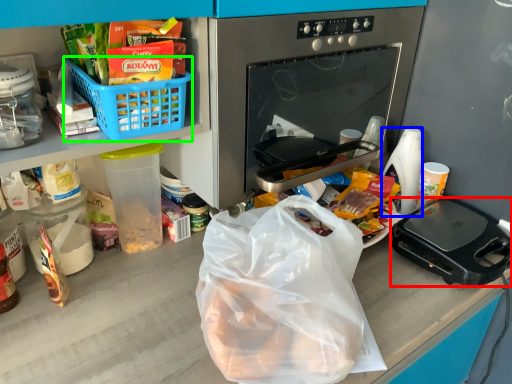
Question: Which object is the farthest from kitchen appliance (highlighted by a red box)? Choose among these: coffee cup (highlighted by a blue box) or basket (highlighted by a green box).

Choices:
 (A) coffee cup
 (B) basket

Answer: (B)